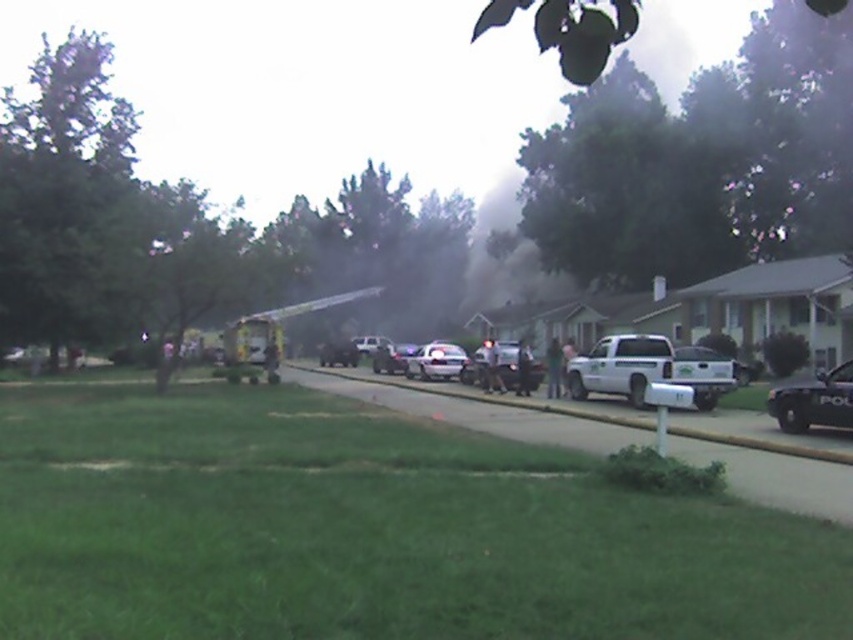
Question: Among these objects, which one is nearest to the camera?

Choices:
 (A) black matte police car at lower right
 (B) green grass at lower left
 (C) yellow reflective fire truck at center
 (D) smooth concrete curb at lower center

Answer: (B)

Question: Is black matte police car at lower right smaller than metallic silver sedan at center?

Choices:
 (A) no
 (B) yes

Answer: (B)

Question: Which point is farther to the camera?

Choices:
 (A) (379, 349)
 (B) (349, 364)

Answer: (B)

Question: Does smooth concrete curb at lower center have a greater width compared to satin silver sedan at center?

Choices:
 (A) yes
 (B) no

Answer: (A)

Question: Based on their relative distances, which object is nearer to the satin silver sedan at center?

Choices:
 (A) smooth concrete curb at lower center
 (B) yellow reflective fire truck at center
 (C) black matte police car at lower right

Answer: (A)

Question: Is green grass at lower left smaller than silver metallic sedan at center?

Choices:
 (A) no
 (B) yes

Answer: (B)